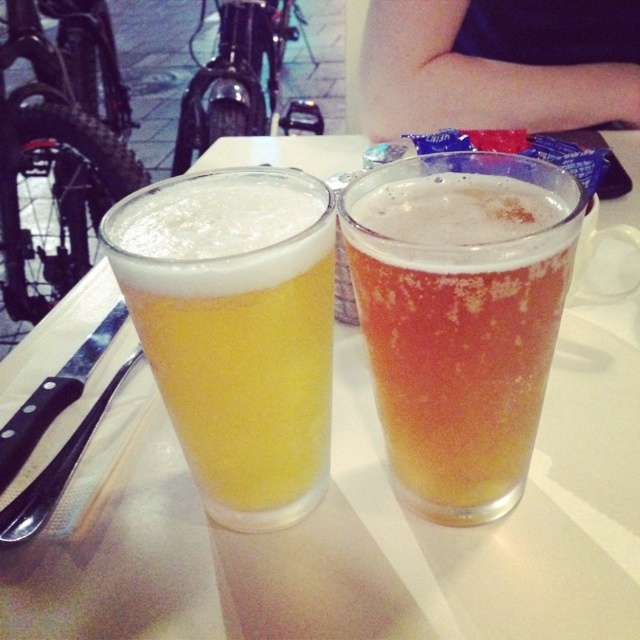
Which is behind, point (426, 508) or point (300, 289)?

The point (426, 508) is more distant.

Who is more forward, (576, 236) or (273, 246)?

Point (273, 246)

The width and height of the screenshot is (640, 640). Find the location of `translucent glass at center`. translucent glass at center is located at coordinates (460, 317).

Locate an element on the screen. The width and height of the screenshot is (640, 640). translucent glass at center is located at coordinates (460, 317).

How distant is translucent glass at center from black plastic knife at left?

A distance of 16.43 centimeters exists between translucent glass at center and black plastic knife at left.

Between translucent glass at center and black plastic knife at left, which one appears on the left side from the viewer's perspective?

black plastic knife at left

Locate an element on the screen. translucent glass at center is located at coordinates (460, 317).

Find the location of `translucent glass at center`. translucent glass at center is located at coordinates (460, 317).

Is point (284, 273) farther from viewer compared to point (97, 401)?

No.

Between translucent glass at left and black plastic knife at left, which one is positioned lower?

black plastic knife at left is lower down.

Between point (232, 504) and point (84, 432), which one is positioned in front?

Point (232, 504)

Identify the location of translucent glass at left. The image size is (640, 640). (236, 330).